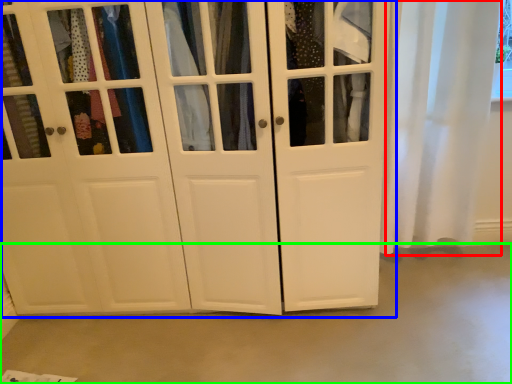
Question: Considering the real-world distances, which object is closest to curtain (highlighted by a red box)? cupboard (highlighted by a blue box) or concrete (highlighted by a green box).

Choices:
 (A) cupboard
 (B) concrete

Answer: (A)